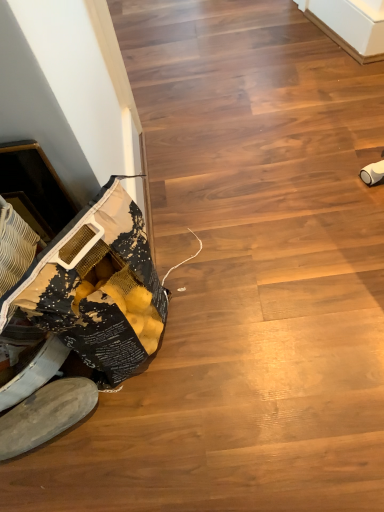
This screenshot has height=512, width=384. In order to click on vacant region to the right of white suede shoe at lower left in this screenshot , I will do `click(131, 423)`.